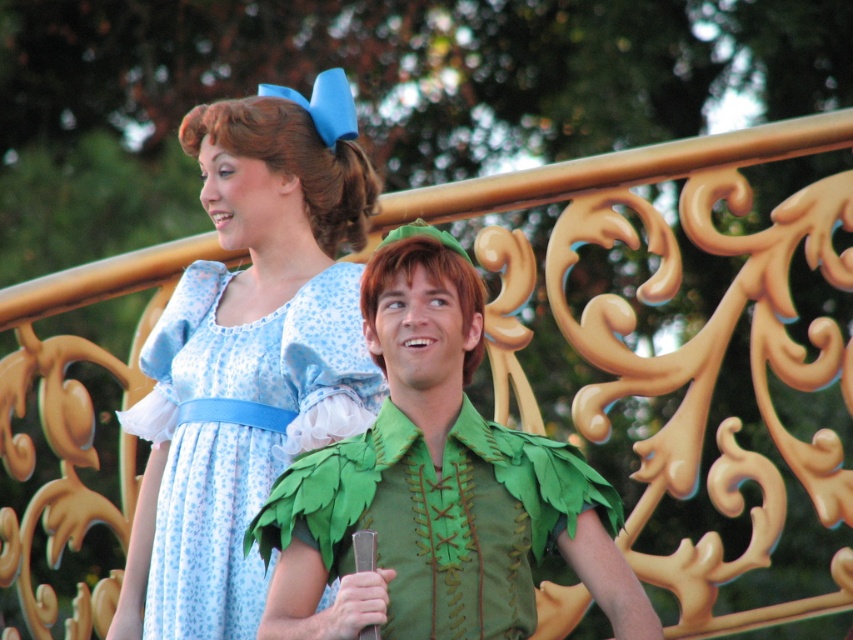
Which is more to the left, green felt vest at center or blue printed fabric dress at center?

blue printed fabric dress at center

Is point (534, 444) more distant than point (357, 371)?

No, it is not.

Where is `green felt vest at center`? The height and width of the screenshot is (640, 853). green felt vest at center is located at coordinates (437, 484).